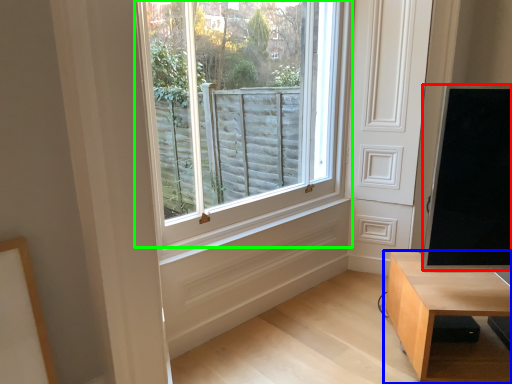
Question: Which is nearer to the window screen (highlighted by a red box)? table (highlighted by a blue box) or window (highlighted by a green box).

Choices:
 (A) table
 (B) window

Answer: (A)